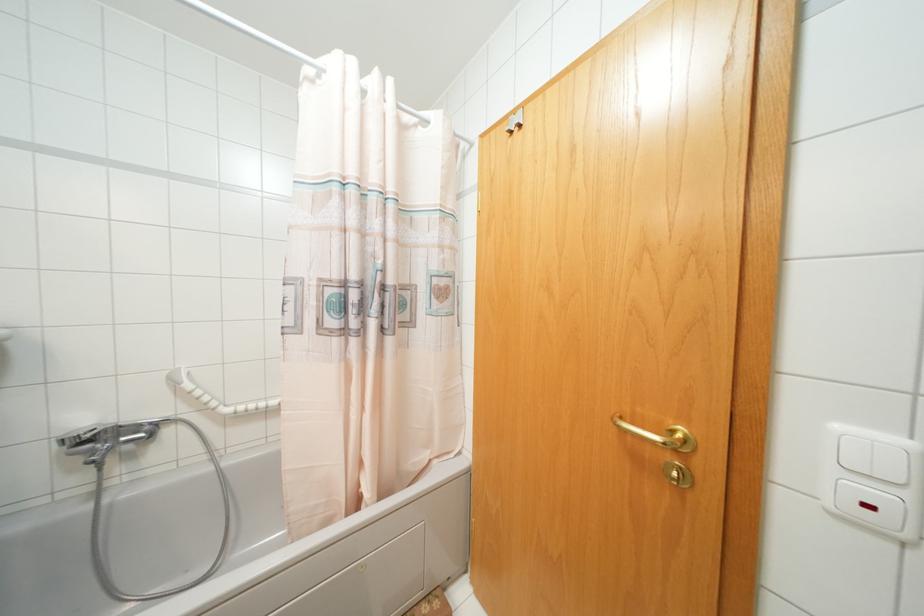
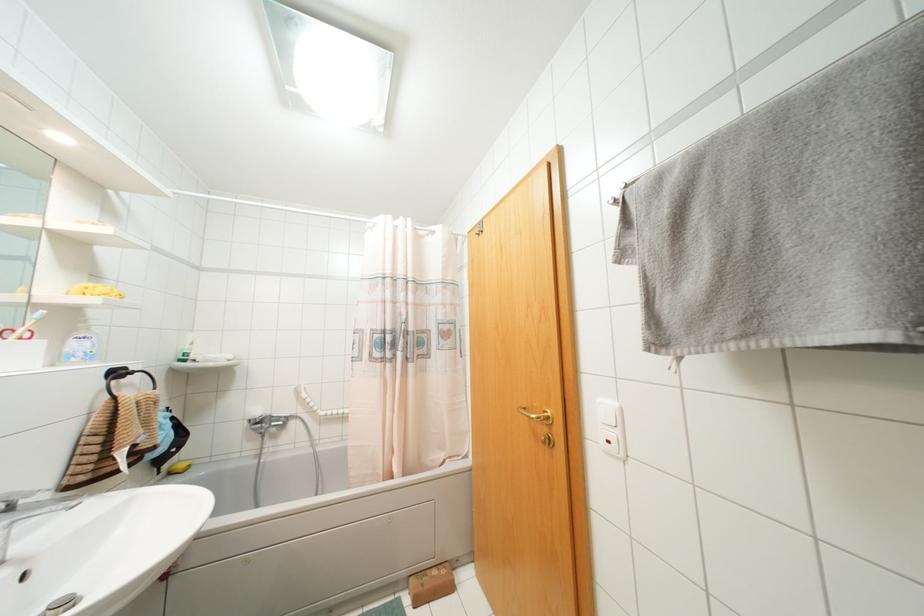
Find the pixel in the second image that matches pixel 84 419 in the first image.

(258, 411)